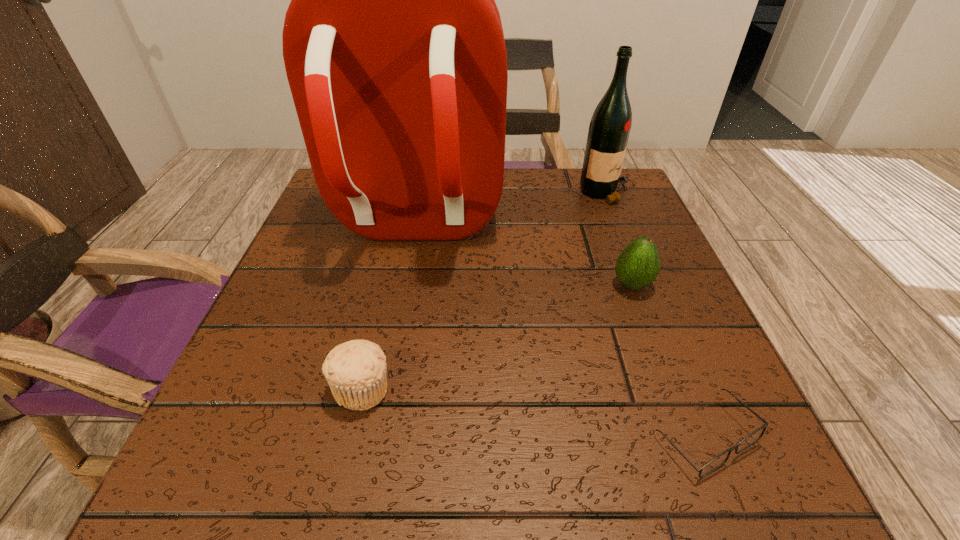
In order to click on the tallest object in this screenshot , I will do `click(393, 45)`.

Locate an element on the screen. The height and width of the screenshot is (540, 960). the fourth shortest object is located at coordinates (610, 125).

The image size is (960, 540). Identify the location of avocado. (637, 266).

Where is `muffin`? muffin is located at coordinates (355, 370).

Identify the location of the shortest object. This screenshot has height=540, width=960. (745, 443).

This screenshot has width=960, height=540. I want to click on free space located on the strap side of the tallest object, so click(x=384, y=389).

Find the location of a particular element. The image size is (960, 540). vacant region located 0.100m on the front of the second tallest object is located at coordinates (623, 231).

Image resolution: width=960 pixels, height=540 pixels. I want to click on blank space located on the front of the third shortest object, so click(x=655, y=346).

Where is `free space located on the front of the muffin`? free space located on the front of the muffin is located at coordinates (343, 470).

You are a GUI agent. You are given a task and a screenshot of the screen. Output one action in this format:
    pyautogui.click(x=<x>, y=<y>)
    Task: Click on the backpack located in the far edge section of the desktop
    
    Given the screenshot: What is the action you would take?
    pyautogui.click(x=393, y=45)